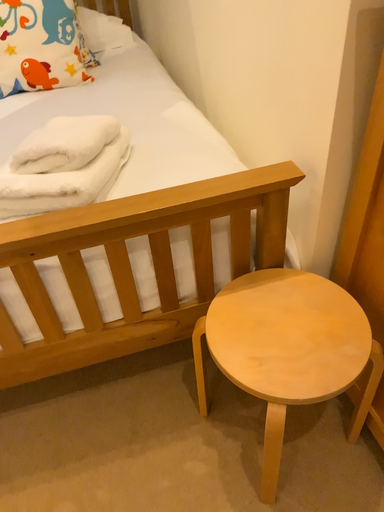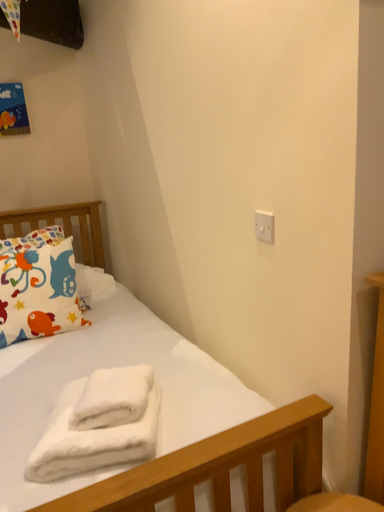
Question: Which way did the camera rotate in the video?

Choices:
 (A) rotated right
 (B) rotated left

Answer: (A)